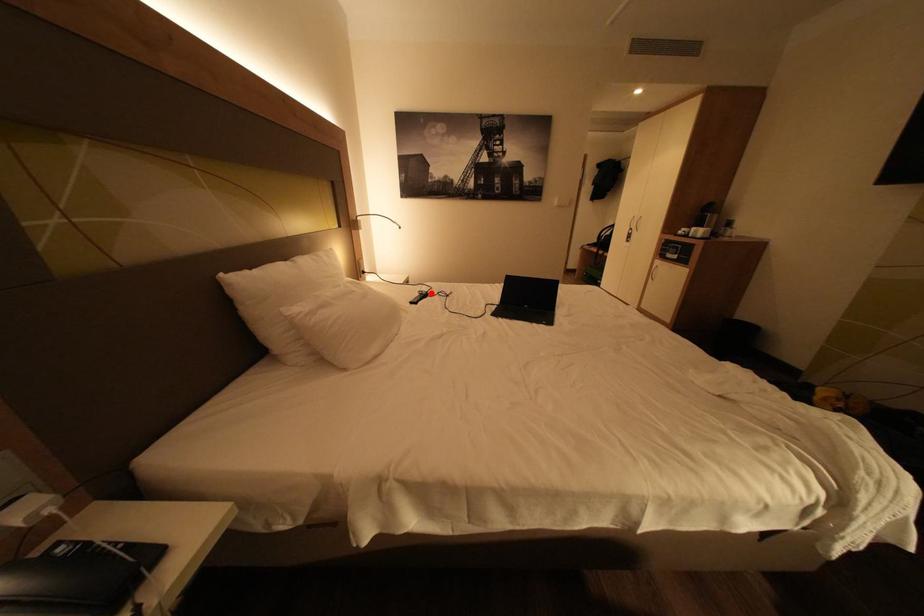
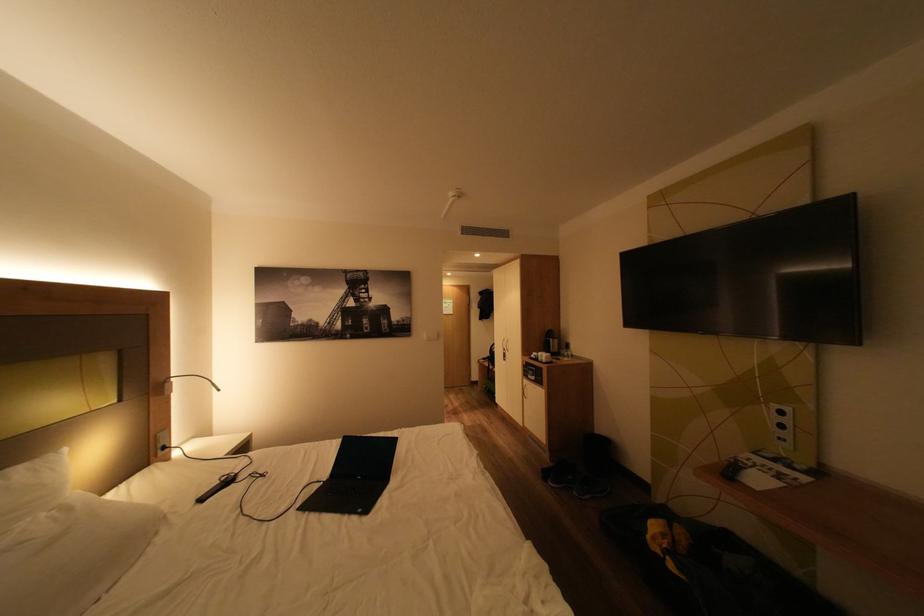
Find the pixel in the second image that matches the highlighted location in the first image.

(235, 479)